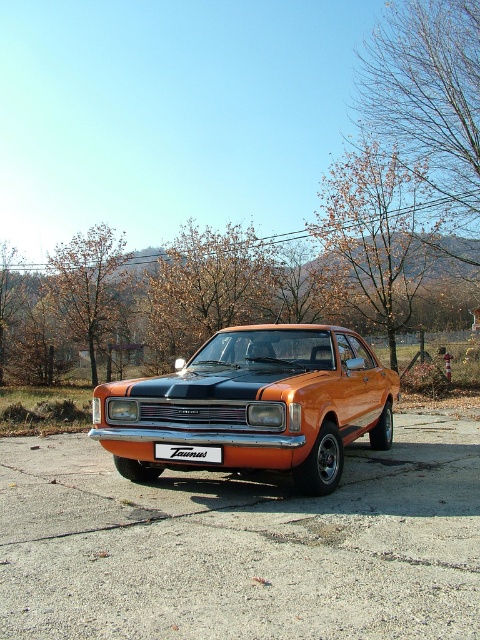
You are a photographer planning to take a photo of the orange metallic car at center and the white plastic sign at center. Which object should you focus on first if you want to capture both in the frame without moving the camera?

The orange metallic car at center is larger in size than the white plastic sign at center, so you should focus on the orange metallic car at center first to ensure it fills the frame appropriately before adjusting for the smaller sign.

You are a delivery driver needing to park your truck next to the orange metallic car at center and the white plastic sign at center. Since the truck is 2 meters wide, can you park between them without overlapping?

The orange metallic car at center is wider than the white plastic sign at center. However, the exact distance between them isn not provided. Without knowing the space between the car and the sign, it is impossible to determine if the truck can fit.

You are driving an orange metallic car at center and need to park it near a white plastic sign at center. Based on the scene, can you determine if the car is currently parked to the left or right of the sign?

The orange metallic car at center is positioned on the right side of white plastic sign at center, so the car is parked to the right of the sign.